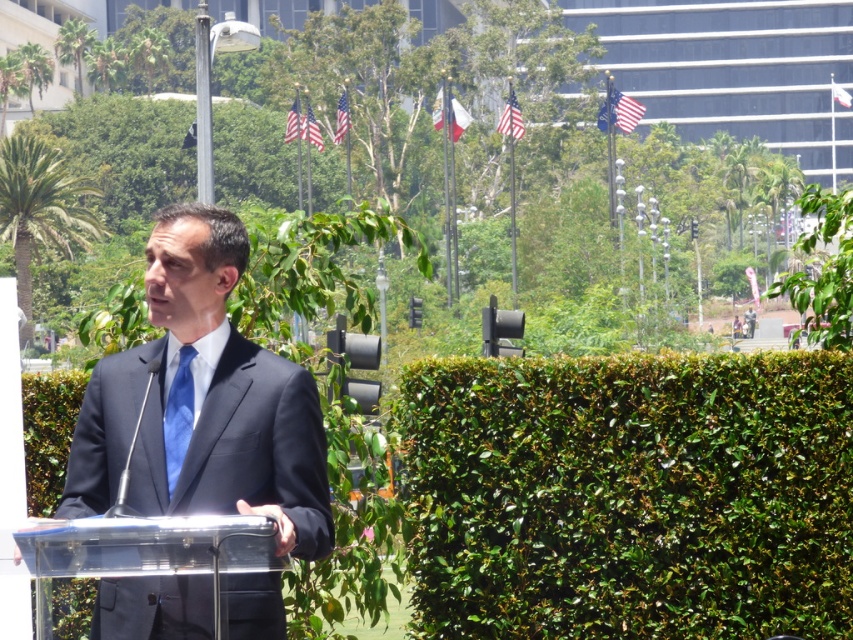
You are a photographer trying to capture the speaker at the podium. The point you need to focus on is point (204, 401). Based on the scene description, which object should you focus on to ensure the speaker is in focus?

The point (204, 401) is on the dark blue suit at center, so you should focus on the speaker wearing the dark blue suit at center to ensure the speaker is in focus.

Based on the scene description, where is the green leafy hedge at right located in the image?

The green leafy hedge at right is located at point coordinates of (630, 496).

You are a photographer at this event and want to capture a photo where the green leafy hedge at right and the dark blue suit at center are both visible. Which object should appear smaller in the photo?

The green leafy hedge at right should appear smaller in the photo because it has a smaller size compared to the dark blue suit at center.